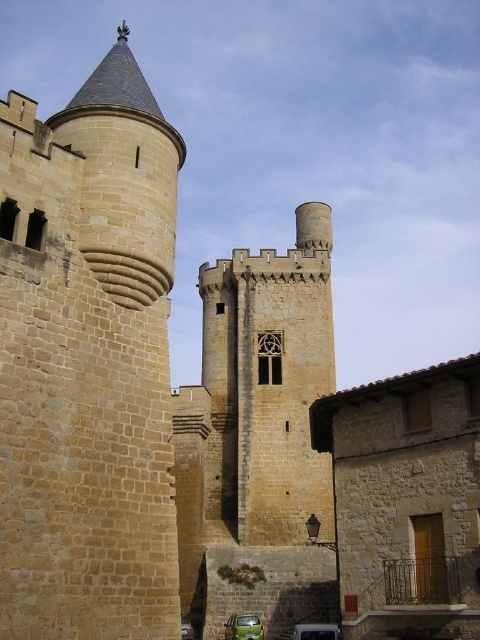
Can you confirm if brown stone tower at left is positioned below brown stone tower at center?

Incorrect, brown stone tower at left is not positioned below brown stone tower at center.

Between point (156, 554) and point (192, 540), which one is positioned behind?

The point (192, 540) is more distant.

This screenshot has height=640, width=480. Identify the location of brown stone tower at left. (87, 362).

Find the location of a particular element. This screenshot has width=480, height=640. brown stone tower at left is located at coordinates (x=87, y=362).